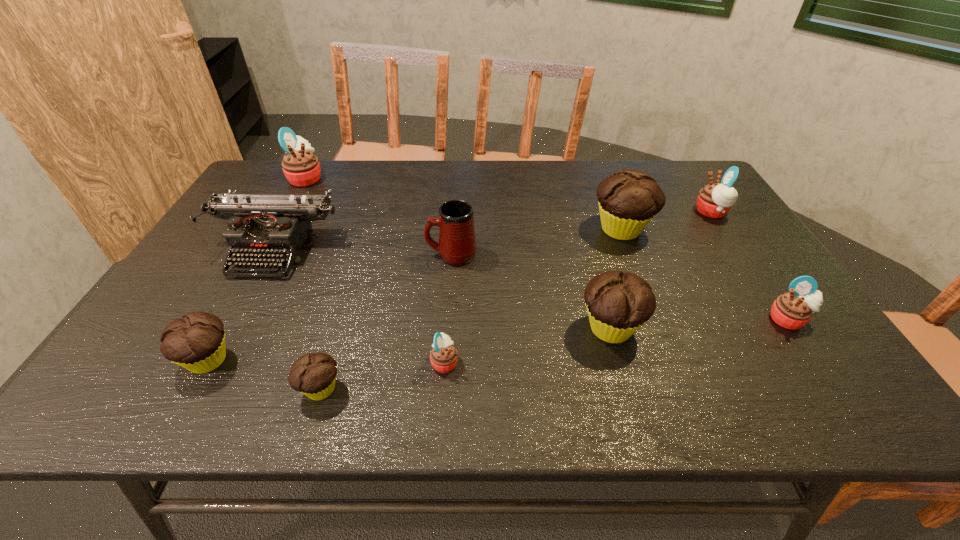
Identify the location of the nearest pink muffin. Image resolution: width=960 pixels, height=540 pixels. (443, 356).

This screenshot has height=540, width=960. What are the coordinates of `the second chocolate muffin from left to right` in the screenshot? It's located at (314, 375).

Identify the location of the seventh object from right to left. (314, 375).

Identify the location of blank space located 0.260m on the front-facing side of the leftmost pink muffin. (400, 178).

Find the location of a particular element. The height and width of the screenshot is (540, 960). free space located 0.230m on the left of the farthest chocolate muffin is located at coordinates (512, 230).

Image resolution: width=960 pixels, height=540 pixels. Identify the location of free space located 0.090m on the front-facing side of the second biggest pink muffin. (666, 212).

You are a GUI agent. You are given a task and a screenshot of the screen. Output one action in this format:
    pyautogui.click(x=<x>, y=<y>)
    Task: Click on the vacant space situated 0.200m on the front-facing side of the second biggest pink muffin
    
    Given the screenshot: What is the action you would take?
    630,212

Identify the location of vacant area located on the front-facing side of the second biggest pink muffin. The width and height of the screenshot is (960, 540). (623, 212).

Where is `blank area located on the side of the red mug with the handle`? The image size is (960, 540). blank area located on the side of the red mug with the handle is located at coordinates (394, 254).

Where is `free space located 0.070m on the side of the red mug with the handle`? The image size is (960, 540). free space located 0.070m on the side of the red mug with the handle is located at coordinates (400, 254).